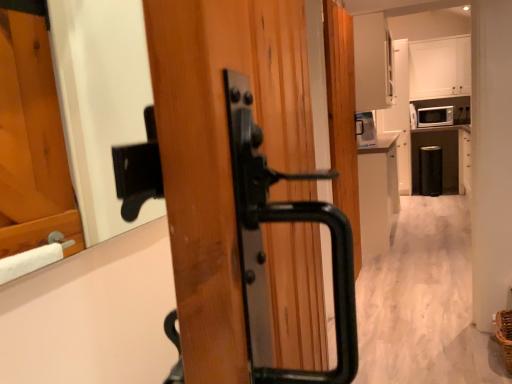
Question: In the image, is white matte cabinet at upper center, which appears as the 1th cabinetry when viewed from the top, positioned in front of or behind matte white microwave at upper right?

Choices:
 (A) behind
 (B) front

Answer: (B)

Question: From a real-world perspective, is white matte cabinet at upper center, the second cabinetry when ordered from bottom to top, physically located above or below matte white microwave at upper right?

Choices:
 (A) above
 (B) below

Answer: (A)

Question: Which object is the farthest from the matte white microwave at upper right?

Choices:
 (A) white matte cabinet at upper center, the 1th cabinetry when ordered from back to front
 (B) white glossy cabinet at center, the 1th cabinetry when ordered from left to right

Answer: (B)

Question: Estimate the real-world distances between objects in this image. Which object is closer to the white matte cabinet at upper center, which is the 2th cabinetry from left to right?

Choices:
 (A) white glossy cabinet at center, the second cabinetry from the top
 (B) matte white microwave at upper right

Answer: (B)